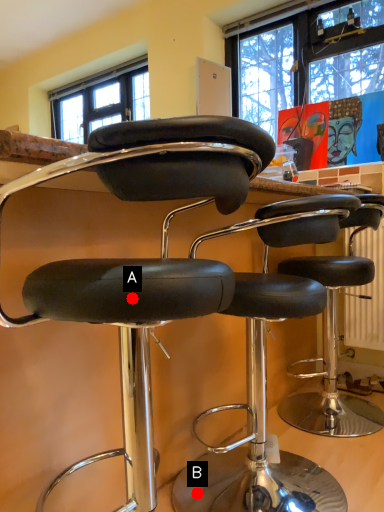
Question: Two points are circled on the image, labeled by A and B beside each circle. Which point is closer to the camera taking this photo?

Choices:
 (A) A is closer
 (B) B is closer

Answer: (A)